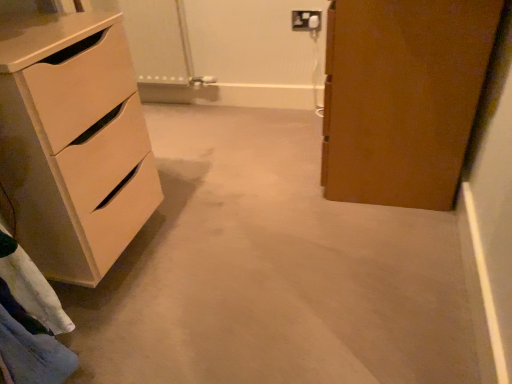
Question: Is beige carpet at center aimed at white plastic electric outlet at upper center?

Choices:
 (A) yes
 (B) no

Answer: (B)

Question: Is beige carpet at center far away from white plastic electric outlet at upper center?

Choices:
 (A) no
 (B) yes

Answer: (B)

Question: From the image's perspective, is beige carpet at center above white plastic electric outlet at upper center?

Choices:
 (A) no
 (B) yes

Answer: (A)

Question: Does beige carpet at center appear on the left side of white plastic electric outlet at upper center?

Choices:
 (A) no
 (B) yes

Answer: (B)

Question: Is beige carpet at center positioned with its back to white plastic electric outlet at upper center?

Choices:
 (A) yes
 (B) no

Answer: (B)

Question: Is beige carpet at center thinner than white plastic electric outlet at upper center?

Choices:
 (A) no
 (B) yes

Answer: (A)

Question: Does beige carpet at center have a smaller size compared to matte white chest of drawers at left?

Choices:
 (A) no
 (B) yes

Answer: (A)

Question: Does beige carpet at center turn towards matte white chest of drawers at left?

Choices:
 (A) yes
 (B) no

Answer: (B)

Question: Can we say beige carpet at center lies outside matte white chest of drawers at left?

Choices:
 (A) no
 (B) yes

Answer: (B)

Question: Does beige carpet at center touch matte white chest of drawers at left?

Choices:
 (A) no
 (B) yes

Answer: (A)

Question: From the image's perspective, is beige carpet at center under matte white chest of drawers at left?

Choices:
 (A) yes
 (B) no

Answer: (A)

Question: Is beige carpet at center behind matte white chest of drawers at left?

Choices:
 (A) yes
 (B) no

Answer: (B)

Question: Is matte white chest of drawers at left taller than beige carpet at center?

Choices:
 (A) yes
 (B) no

Answer: (A)